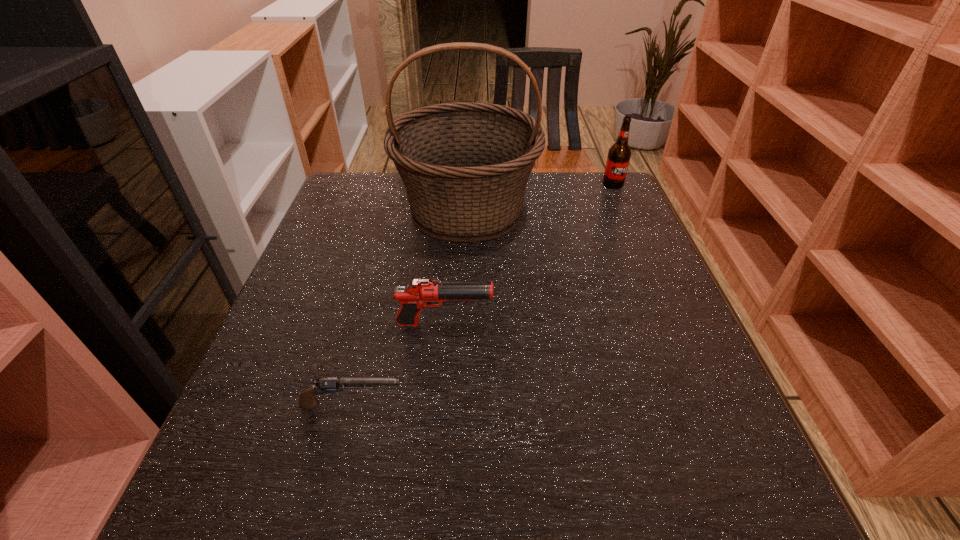
Image resolution: width=960 pixels, height=540 pixels. Find the location of `the tallest object`. the tallest object is located at coordinates (465, 166).

In order to click on the second tallest object in this screenshot , I will do `click(618, 159)`.

This screenshot has height=540, width=960. What are the coordinates of `root beer` in the screenshot? It's located at (618, 159).

Locate an element on the screen. The image size is (960, 540). the farther gun is located at coordinates (418, 293).

You are a GUI agent. You are given a task and a screenshot of the screen. Output one action in this format:
    pyautogui.click(x=<x>, y=<y>)
    Task: Click on the taller gun
    
    Given the screenshot: What is the action you would take?
    pyautogui.click(x=418, y=293)

This screenshot has width=960, height=540. Identify the location of the shortest object. (307, 400).

Locate an element on the screen. This screenshot has width=960, height=540. the shorter gun is located at coordinates (307, 400).

The height and width of the screenshot is (540, 960). I want to click on vacant space located 0.220m on the right of the basket, so click(x=620, y=211).

At what (x,y) coordinates should I click in order to perform the action: click on free space located 0.130m on the left of the rightmost object. Please return your answer as a coordinate pair (x, y). Looking at the image, I should click on (558, 184).

The image size is (960, 540). What are the coordinates of `vacant area located 0.320m at the aiming end of the taller gun` in the screenshot? It's located at (653, 324).